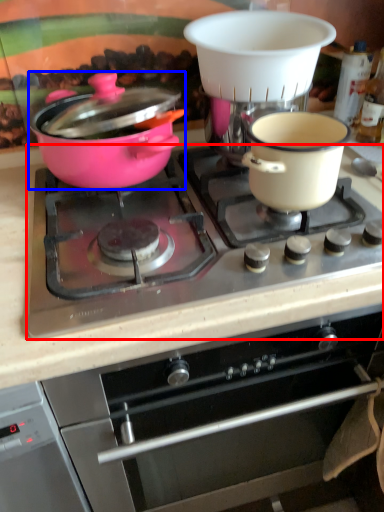
Question: Which object appears farthest to the camera in this image, gas stove (highlighted by a red box) or pot/pan (highlighted by a blue box)?

Choices:
 (A) gas stove
 (B) pot/pan

Answer: (B)